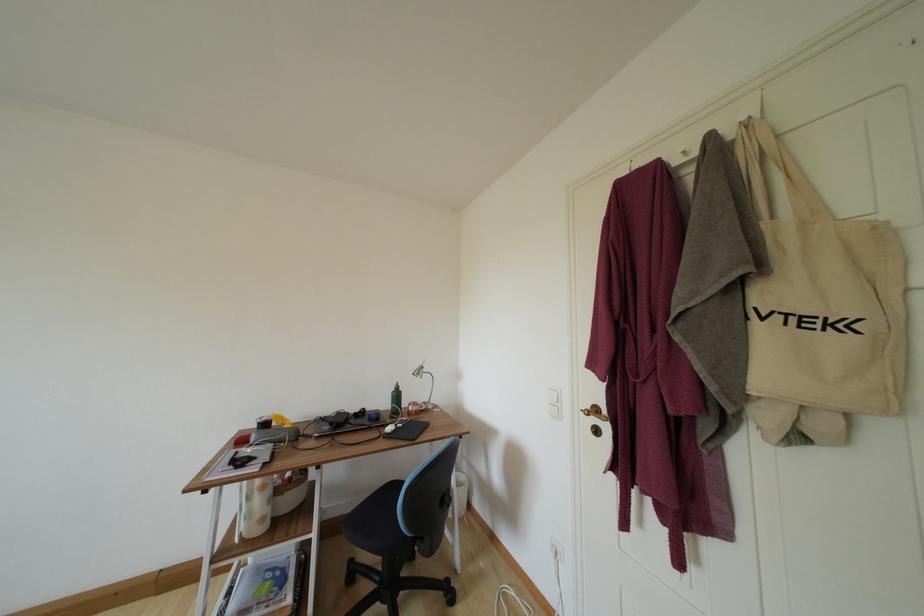
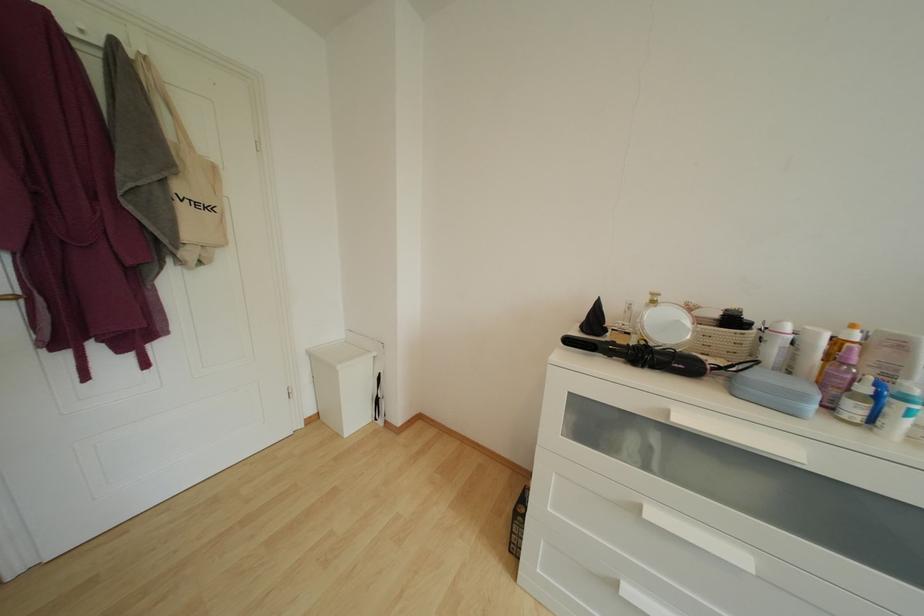
Question: How did the camera likely rotate?

Choices:
 (A) Left
 (B) Right
 (C) Up
 (D) Down

Answer: (B)